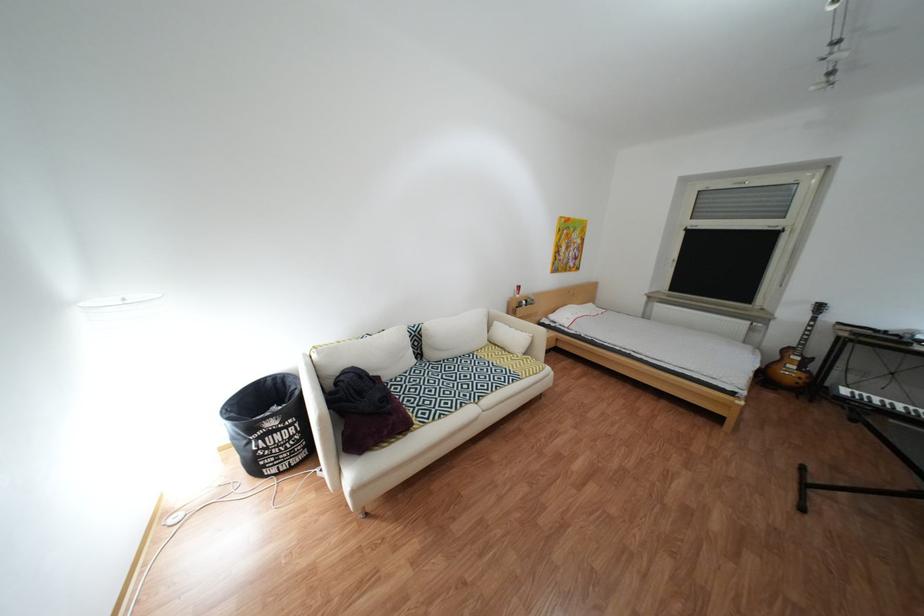
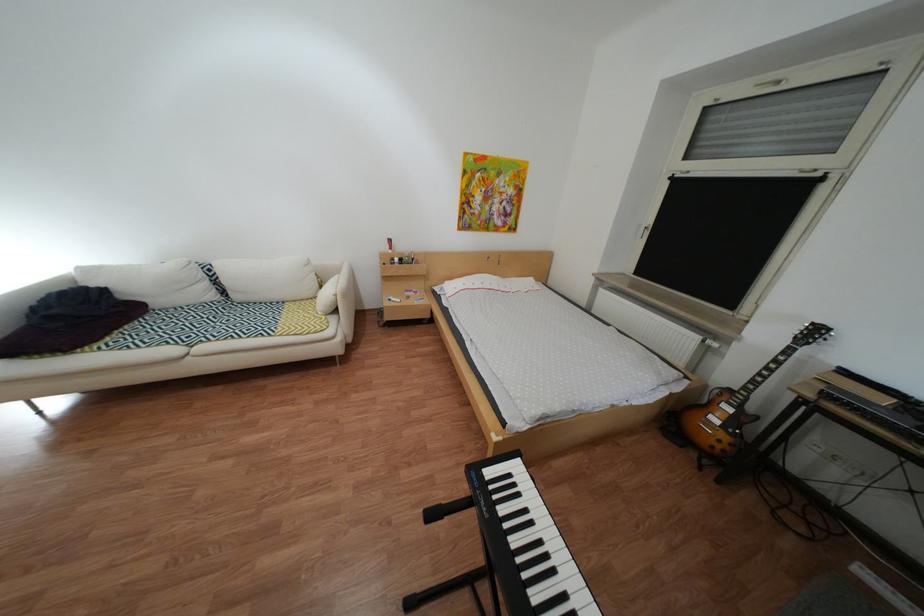
In the second image, find the point that corresponds to [824,309] in the first image.

(810, 330)